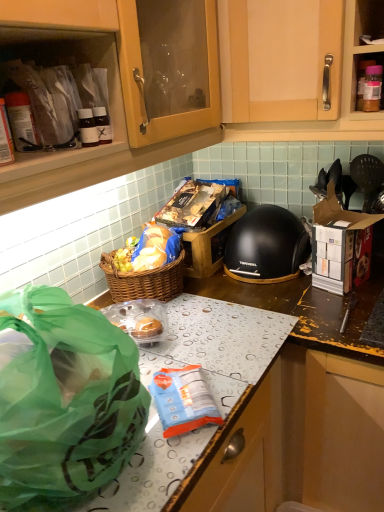
Question: Is black matte helmet at center to the left of blue plastic bag at center from the viewer's perspective?

Choices:
 (A) no
 (B) yes

Answer: (A)

Question: Is black matte helmet at center oriented towards blue plastic bag at center?

Choices:
 (A) yes
 (B) no

Answer: (A)

Question: Considering the relative sizes of black matte helmet at center and blue plastic bag at center in the image provided, is black matte helmet at center bigger than blue plastic bag at center?

Choices:
 (A) yes
 (B) no

Answer: (A)

Question: Considering the relative sizes of black matte helmet at center and blue plastic bag at center in the image provided, is black matte helmet at center taller than blue plastic bag at center?

Choices:
 (A) yes
 (B) no

Answer: (A)

Question: Is black matte helmet at center further to the viewer compared to blue plastic bag at center?

Choices:
 (A) no
 (B) yes

Answer: (B)

Question: Relative to matte plastic containers at upper left, is black matte helmet at center in front or behind?

Choices:
 (A) behind
 (B) front

Answer: (A)

Question: From the image's perspective, is black matte helmet at center located above or below matte plastic containers at upper left?

Choices:
 (A) below
 (B) above

Answer: (A)

Question: Is black matte helmet at center inside the boundaries of matte plastic containers at upper left, or outside?

Choices:
 (A) outside
 (B) inside

Answer: (A)

Question: Does point (281, 216) appear closer or farther from the camera than point (43, 161)?

Choices:
 (A) farther
 (B) closer

Answer: (A)

Question: In terms of size, does green translucent bag at lower left appear bigger or smaller than matte plastic containers at upper left?

Choices:
 (A) small
 (B) big

Answer: (B)

Question: In terms of height, does green translucent bag at lower left look taller or shorter compared to matte plastic containers at upper left?

Choices:
 (A) short
 (B) tall

Answer: (B)

Question: From the image's perspective, is green translucent bag at lower left located above or below matte plastic containers at upper left?

Choices:
 (A) below
 (B) above

Answer: (A)

Question: Considering the relative positions of green translucent bag at lower left and matte plastic containers at upper left in the image provided, is green translucent bag at lower left to the left or to the right of matte plastic containers at upper left?

Choices:
 (A) right
 (B) left

Answer: (A)

Question: Is matte plastic containers at upper left inside or outside of green translucent bag at lower left?

Choices:
 (A) inside
 (B) outside

Answer: (B)

Question: From the image's perspective, is matte plastic containers at upper left above or below green translucent bag at lower left?

Choices:
 (A) above
 (B) below

Answer: (A)